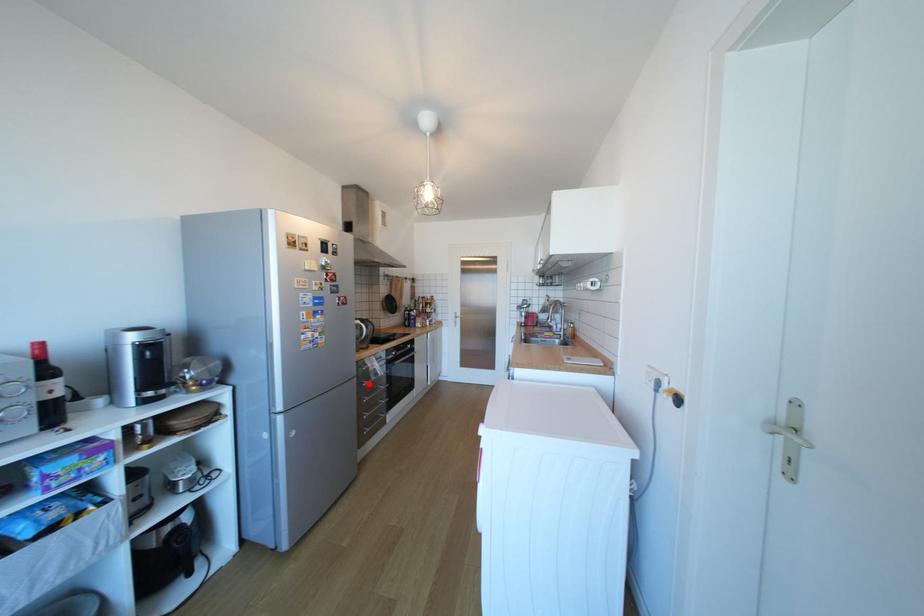
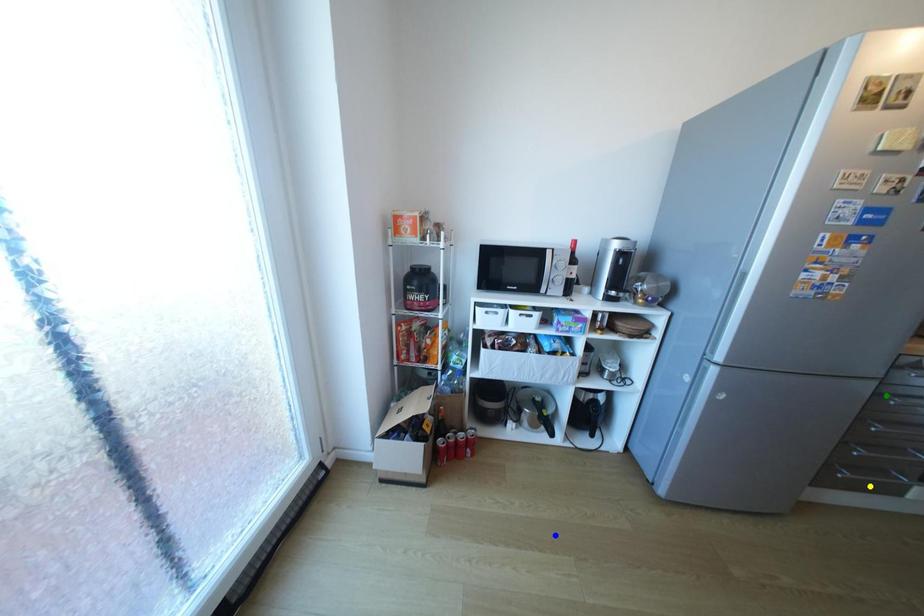
Question: I am providing you with two images of the same scene from different viewpoints. A red point is marked on the first image. You are given multiple points on the second image. Can you choose the point in image 2 that corresponds to the point in image 1?

Choices:
 (A) yellow point
 (B) blue point
 (C) green point

Answer: (C)